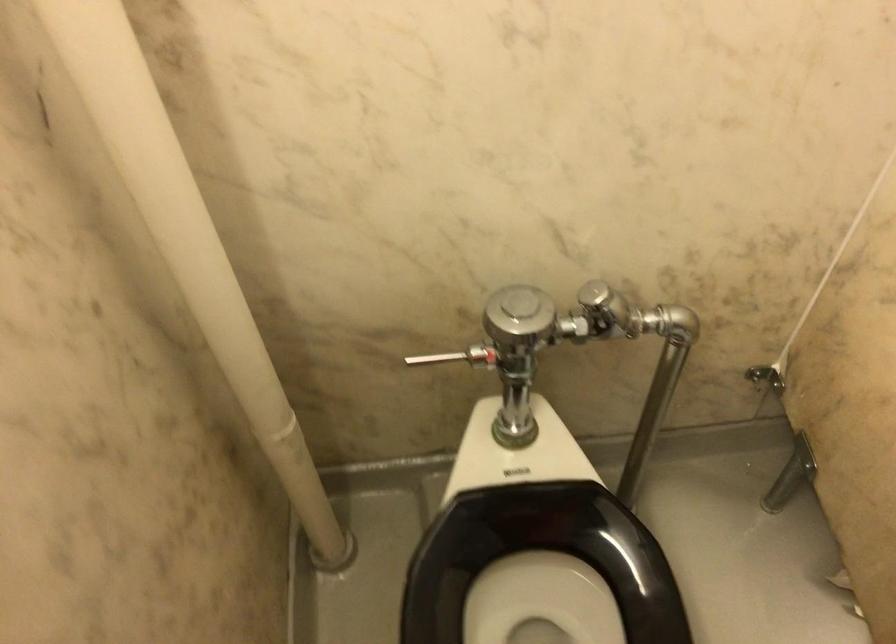
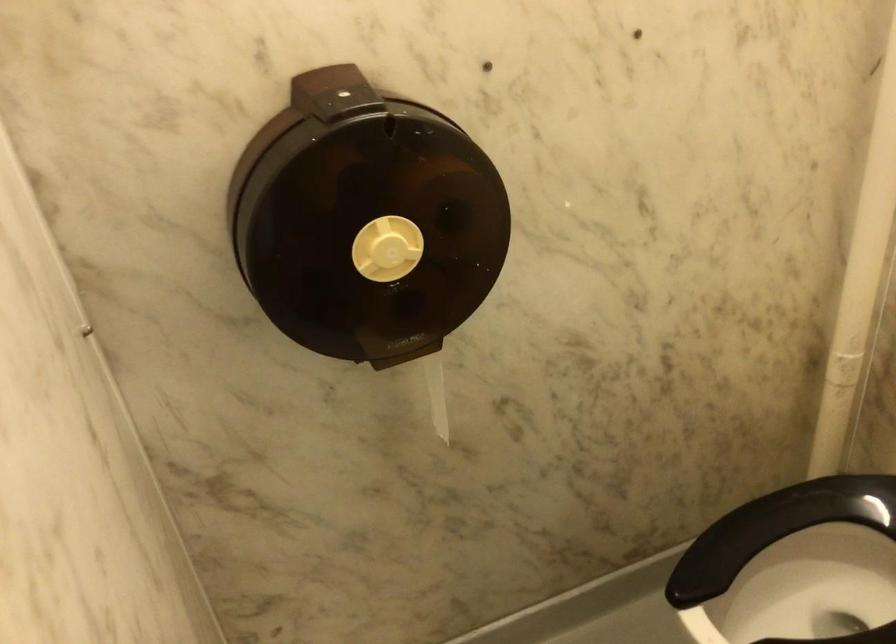
Question: The camera is either moving clockwise (left) or counter-clockwise (right) around the object. The first image is from the beginning of the video and the second image is from the end. Is the camera moving left or right when shooting the video?

Choices:
 (A) Left
 (B) Right

Answer: (B)